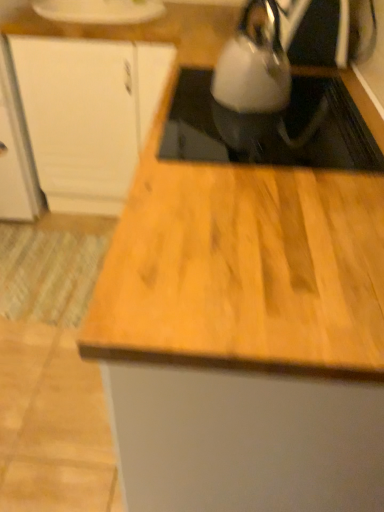
Question: Does white glossy kettle at upper center appear on the left side of white matte cabinet at upper left?

Choices:
 (A) no
 (B) yes

Answer: (A)

Question: Does white glossy kettle at upper center have a smaller size compared to white matte cabinet at upper left?

Choices:
 (A) no
 (B) yes

Answer: (B)

Question: Is white matte cabinet at upper left surrounded by white glossy kettle at upper center?

Choices:
 (A) yes
 (B) no

Answer: (B)

Question: From the image's perspective, is white glossy kettle at upper center above white matte cabinet at upper left?

Choices:
 (A) no
 (B) yes

Answer: (A)

Question: Is white glossy kettle at upper center facing away from white matte cabinet at upper left?

Choices:
 (A) yes
 (B) no

Answer: (B)

Question: In the image, is white glossy kettle at upper center on the left side or the right side of satin silver kettle at upper right?

Choices:
 (A) right
 (B) left

Answer: (A)

Question: Would you say white glossy kettle at upper center is inside or outside satin silver kettle at upper right?

Choices:
 (A) inside
 (B) outside

Answer: (B)

Question: Is white glossy kettle at upper center taller or shorter than satin silver kettle at upper right?

Choices:
 (A) tall
 (B) short

Answer: (B)

Question: Is point (190, 150) closer or farther from the camera than point (244, 55)?

Choices:
 (A) farther
 (B) closer

Answer: (B)

Question: In terms of width, does white glossy kettle at upper center look wider or thinner when compared to white matte cabinet at upper left?

Choices:
 (A) wide
 (B) thin

Answer: (B)

Question: Looking at the image, does white glossy kettle at upper center seem bigger or smaller compared to white matte cabinet at upper left?

Choices:
 (A) big
 (B) small

Answer: (B)

Question: From a real-world perspective, relative to white matte cabinet at upper left, is white glossy kettle at upper center vertically above or below?

Choices:
 (A) above
 (B) below

Answer: (A)

Question: Visually, is white glossy kettle at upper center positioned to the left or to the right of white matte cabinet at upper left?

Choices:
 (A) right
 (B) left

Answer: (A)

Question: Considering the positions of satin silver kettle at upper right and white matte cabinet at upper left in the image, is satin silver kettle at upper right wider or thinner than white matte cabinet at upper left?

Choices:
 (A) thin
 (B) wide

Answer: (A)

Question: Based on their sizes in the image, would you say satin silver kettle at upper right is bigger or smaller than white matte cabinet at upper left?

Choices:
 (A) big
 (B) small

Answer: (B)